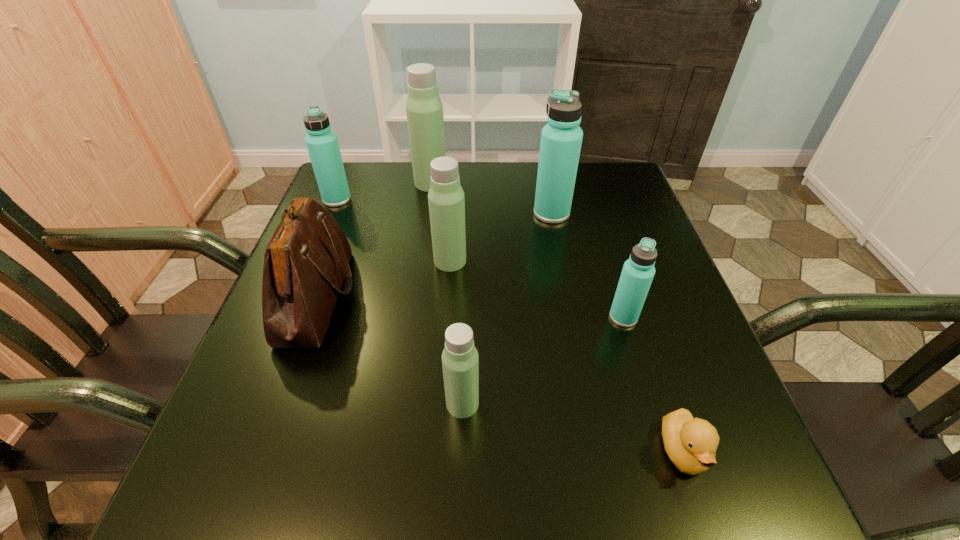
Locate an element on the screen. the farthest light thermos bottle is located at coordinates (424, 109).

This screenshot has width=960, height=540. What are the coordinates of `the second aqua thermos bottle from left to right` in the screenshot? It's located at (561, 138).

Locate an element on the screen. the biggest aqua thermos bottle is located at coordinates (561, 138).

At what (x,y) coordinates should I click in order to perform the action: click on the leftmost thermos bottle. Please return your answer as a coordinate pair (x, y). This screenshot has width=960, height=540. Looking at the image, I should click on (322, 144).

At what (x,y) coordinates should I click in order to perform the action: click on the leftmost aqua thermos bottle. Please return your answer as a coordinate pair (x, y). Looking at the image, I should click on (322, 144).

Identify the location of the second farthest light thermos bottle. (446, 200).

Identify the location of the third nearest thermos bottle. The image size is (960, 540). tap(446, 200).

Identify the location of shoulder bag. This screenshot has width=960, height=540. tap(307, 260).

I want to click on the smallest aqua thermos bottle, so coord(638,271).

Identify the location of the fifth farthest thermos bottle. (638, 271).